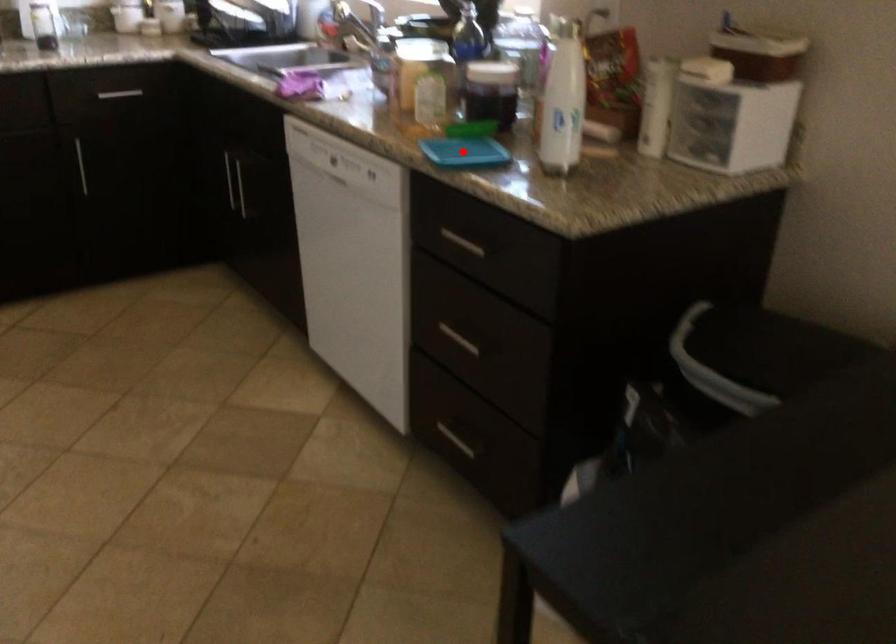
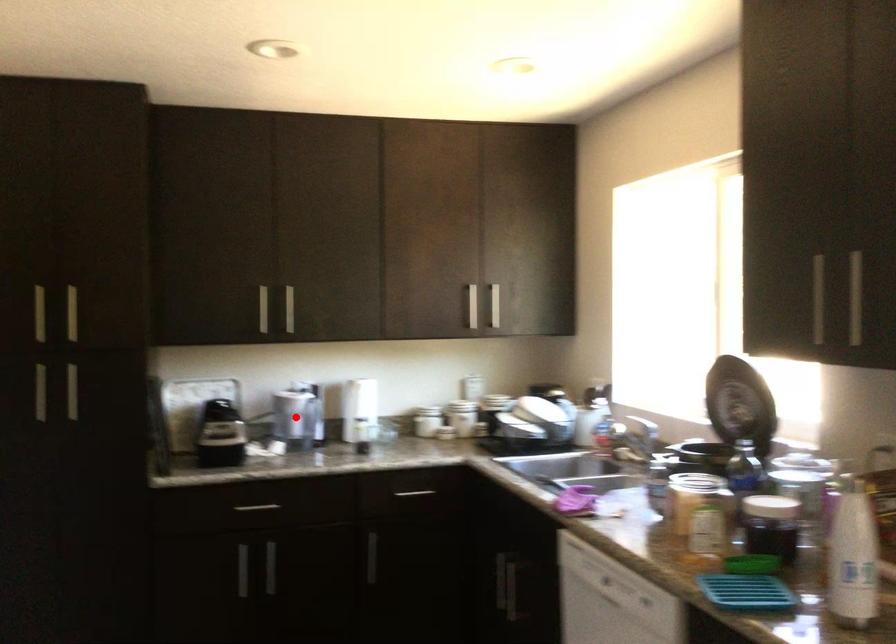
I am providing you with two images of the same scene from different viewpoints. A red point is marked on the first image and another point is marked on the second image. Do the highlighted points in image1 and image2 indicate the same real-world spot?

No